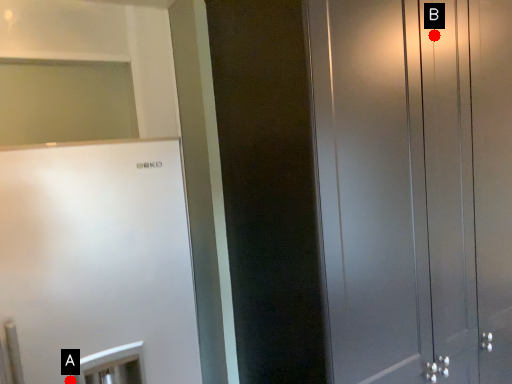
Question: Two points are circled on the image, labeled by A and B beside each circle. Among these points, which one is nearest to the camera?

Choices:
 (A) A is closer
 (B) B is closer

Answer: (A)